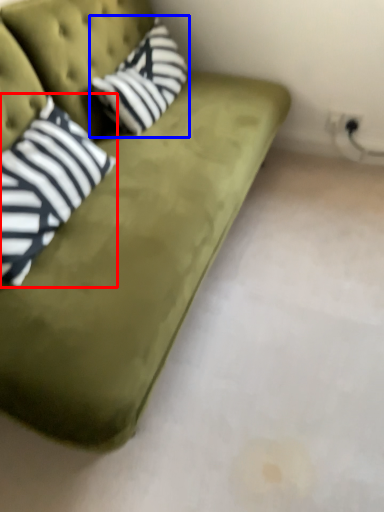
Question: Which point is closer to the camera, pillow (highlighted by a red box) or throw pillow (highlighted by a blue box)?

Choices:
 (A) pillow
 (B) throw pillow

Answer: (A)